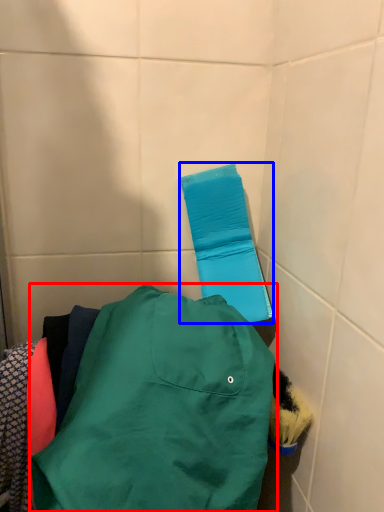
Question: Which of the following is the closest to the observer, jacket (highlighted by a red box) or towel bar (highlighted by a blue box)?

Choices:
 (A) jacket
 (B) towel bar

Answer: (A)